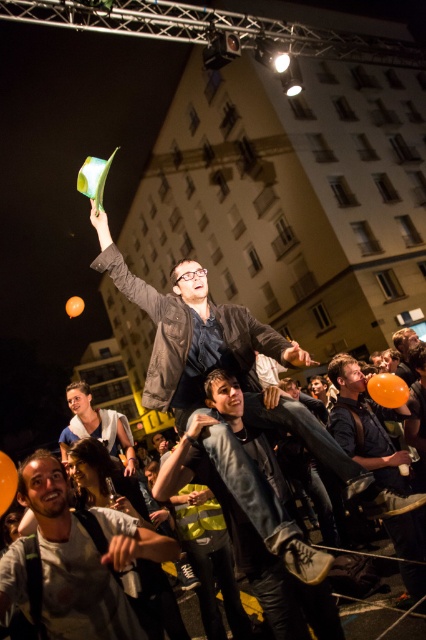
Looking at this image, you are at an event and want to take a photo of the orange matte balloon at upper center without including the matte black shirt at lower right in the frame. Based on their positions, which direction should you move your camera to the left or right?

The matte black shirt at lower right is to the right of the orange matte balloon at upper center. To exclude the matte black shirt at lower right from the frame while focusing on the orange matte balloon at upper center, you should move your camera to the left.

You are a photographer trying to capture a photo of the matte black jacket at center and the matte black shirt at lower right. Since both are dark, you want to ensure they are distinguishable in the photo. Based on their positions, which one is more to the left?

The matte black jacket at center is positioned on the left side of matte black shirt at lower right, so the matte black jacket at center is more to the left.